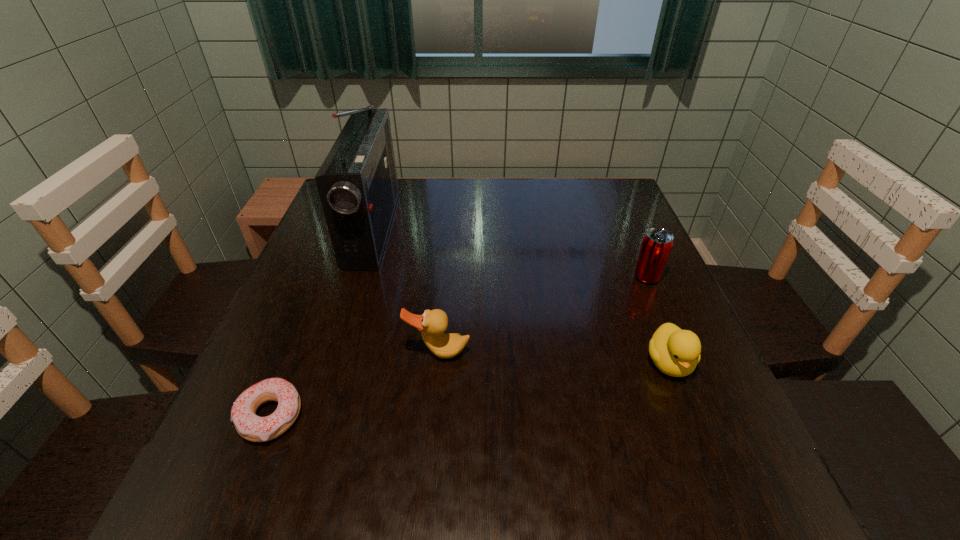
This screenshot has width=960, height=540. What are the coordinates of `vacant space located on the right of the shortest object` in the screenshot? It's located at (512, 416).

Identify the location of object that is at the far edge. (357, 183).

You are a GUI agent. You are given a task and a screenshot of the screen. Output one action in this format:
    pyautogui.click(x=<x>, y=<y>)
    Task: Click on the radio receiver located at the left edge
    The height and width of the screenshot is (540, 960).
    Given the screenshot: What is the action you would take?
    pyautogui.click(x=357, y=183)

Where is `doughnut located at the left edge`? The image size is (960, 540). doughnut located at the left edge is located at coordinates (251, 427).

Locate an element on the screen. soda can that is at the right edge is located at coordinates (657, 243).

Where is `duck that is positioned at the right edge`? The height and width of the screenshot is (540, 960). duck that is positioned at the right edge is located at coordinates (676, 352).

At what (x,y) coordinates should I click in order to perform the action: click on object located in the far left corner section of the desktop. Please return your answer as a coordinate pair (x, y). Looking at the image, I should click on (357, 183).

Locate an element on the screen. The image size is (960, 540). vacant space at the far edge is located at coordinates (470, 202).

You are a GUI agent. You are given a task and a screenshot of the screen. Output one action in this format:
    pyautogui.click(x=<x>, y=<y>)
    Task: Click on the vacant space at the near edge of the desktop
    
    Given the screenshot: What is the action you would take?
    pyautogui.click(x=497, y=490)

Locate an element on the screen. This screenshot has height=540, width=960. vacant space at the left edge of the desktop is located at coordinates (300, 297).